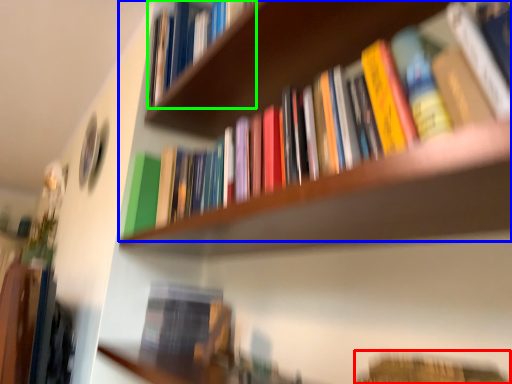
Question: Estimate the real-world distances between objects in this image. Which object is farther from book (highlighted by a red box), book (highlighted by a blue box) or book (highlighted by a green box)?

Choices:
 (A) book
 (B) book

Answer: (B)